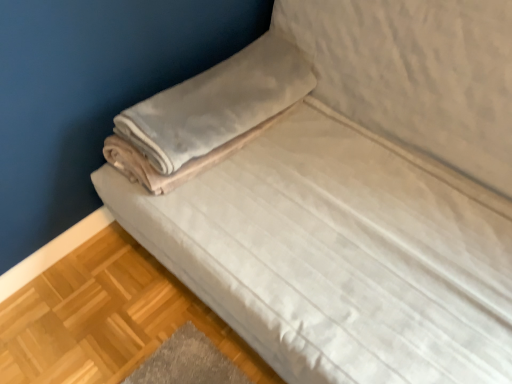
The image size is (512, 384). In order to click on free space above velvet gray pillow at upper left (from a real-world perspective) in this screenshot , I will do pyautogui.click(x=200, y=94).